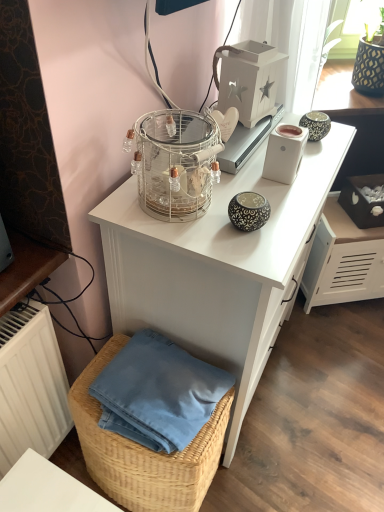
In order to face black cardboard box at right, should I rotate leftwards or rightwards?

Rotate right and turn 23.956 degrees.

The height and width of the screenshot is (512, 384). What do you see at coordinates (363, 200) in the screenshot? I see `black cardboard box at right` at bounding box center [363, 200].

Find the location of `white matte file cabinet at right`. white matte file cabinet at right is located at coordinates (343, 260).

Considering their positions, is woven straw basket at lower left located in front of or behind white matte rectangular device at upper center, the 2th appliance when ordered from top to bottom?

Visually, woven straw basket at lower left is located in front of white matte rectangular device at upper center, the 2th appliance when ordered from top to bottom.

Which of these two, woven straw basket at lower left or white matte rectangular device at upper center, arranged as the first appliance when ordered from the bottom, is wider?

woven straw basket at lower left.

In the scene shown: Is woven straw basket at lower left shorter than white matte rectangular device at upper center, the 2th appliance when ordered from top to bottom?

No.

Which point is more forward, (237, 68) or (192, 135)?

The point (192, 135) is more forward.

Are white wooden lantern at upper center, which is the 2th appliance from bottom to top, and clear glass birdcage at upper center far apart?

No.

What's the angular difference between white wooden lantern at upper center, acting as the first appliance starting from the top, and clear glass birdcage at upper center's facing directions?

11.2 degrees.

Is white wooden lantern at upper center, which is the 2th appliance from bottom to top, positioned with its back to clear glass birdcage at upper center?

No, white wooden lantern at upper center, which is the 2th appliance from bottom to top, is not facing the opposite direction of clear glass birdcage at upper center.

Is black cardboard box at right oriented away from white matte rectangular device at upper center, the 2th appliance when ordered from top to bottom?

black cardboard box at right does not have its back to white matte rectangular device at upper center, the 2th appliance when ordered from top to bottom.

Based on their positions, is black cardboard box at right located to the left or right of white matte rectangular device at upper center, the 2th appliance when ordered from top to bottom?

Clearly, black cardboard box at right is on the right of white matte rectangular device at upper center, the 2th appliance when ordered from top to bottom, in the image.

Is black cardboard box at right situated inside white matte rectangular device at upper center, the 2th appliance when ordered from top to bottom, or outside?

black cardboard box at right is located beyond the bounds of white matte rectangular device at upper center, the 2th appliance when ordered from top to bottom.

Looking at this image, is black cardboard box at right wider than white matte rectangular device at upper center, the 2th appliance when ordered from top to bottom?

Correct, the width of black cardboard box at right exceeds that of white matte rectangular device at upper center, the 2th appliance when ordered from top to bottom.

Could you tell me if black cardboard box at right is facing woven straw basket at lower left?

No, black cardboard box at right does not turn towards woven straw basket at lower left.

Considering the sizes of objects black cardboard box at right and woven straw basket at lower left in the image provided, who is shorter, black cardboard box at right or woven straw basket at lower left?

black cardboard box at right.

You are a GUI agent. You are given a task and a screenshot of the screen. Output one action in this format:
    pyautogui.click(x=<x>, y=<y>)
    Task: Click on the box that appears behind the woven straw basket at lower left
    Image resolution: width=384 pixels, height=512 pixels.
    Given the screenshot: What is the action you would take?
    pyautogui.click(x=363, y=200)

Considering the points (300, 155) and (379, 212), which point is behind, point (300, 155) or point (379, 212)?

The point (379, 212) is more distant.

Are white matte rectangular device at upper center, arranged as the first appliance when ordered from the bottom, and black cardboard box at right far apart?

No, white matte rectangular device at upper center, arranged as the first appliance when ordered from the bottom, is not far away from black cardboard box at right.

Which is more to the left, white matte rectangular device at upper center, arranged as the first appliance when ordered from the bottom, or black cardboard box at right?

white matte rectangular device at upper center, arranged as the first appliance when ordered from the bottom.

How many degrees apart are the facing directions of white matte rectangular device at upper center, the 2th appliance when ordered from top to bottom, and black cardboard box at right?

53.2 degrees.

Visually, is white matte file cabinet at right positioned to the left or to the right of clear glass birdcage at upper center?

From the image, it's evident that white matte file cabinet at right is to the right of clear glass birdcage at upper center.

At what (x,y) coordinates should I click in order to perform the action: click on file cabinet that appears below the clear glass birdcage at upper center (from the image's perspective). Please return your answer as a coordinate pair (x, y). Looking at the image, I should click on (343, 260).

From the image's perspective, is white matte file cabinet at right below clear glass birdcage at upper center?

Yes, from the image's perspective, white matte file cabinet at right is below clear glass birdcage at upper center.

Which of these two, white matte file cabinet at right or clear glass birdcage at upper center, is bigger?

white matte file cabinet at right.

Which is in front, white matte file cabinet at right or white glossy desk at upper center?

Positioned in front is white glossy desk at upper center.

Is white matte file cabinet at right placed right next to white glossy desk at upper center?

There is a gap between white matte file cabinet at right and white glossy desk at upper center.

Which of these two, white matte file cabinet at right or white glossy desk at upper center, is wider?

With larger width is white glossy desk at upper center.

The height and width of the screenshot is (512, 384). I want to click on the 1st appliance behind the woven straw basket at lower left, starting your count from the anchor, so click(284, 153).

The width and height of the screenshot is (384, 512). What are the coordinates of `bird cage on the left of white wooden lantern at upper center, acting as the first appliance starting from the top` in the screenshot? It's located at (176, 163).

From the image, which object appears to be farther from white wooden lantern at upper center, which is the 2th appliance from bottom to top, black cardboard box at right or woven straw basket at lower left?

woven straw basket at lower left.

Looking at the image, which one is located closer to woven straw basket at lower left, clear glass birdcage at upper center or white matte rectangular device at upper center, the 2th appliance when ordered from top to bottom?

clear glass birdcage at upper center is closer to woven straw basket at lower left.

Estimate the real-world distances between objects in this image. Which object is closer to clear glass birdcage at upper center, woven straw basket at lower left or white matte rectangular device at upper center, the 2th appliance when ordered from top to bottom?

The object closer to clear glass birdcage at upper center is white matte rectangular device at upper center, the 2th appliance when ordered from top to bottom.

Estimate the real-world distances between objects in this image. Which object is further from white wooden lantern at upper center, acting as the first appliance starting from the top, white matte file cabinet at right or woven straw basket at lower left?

woven straw basket at lower left lies further to white wooden lantern at upper center, acting as the first appliance starting from the top, than the other object.

From the image, which object appears to be nearer to white glossy desk at upper center, black cardboard box at right or white matte file cabinet at right?

The object closer to white glossy desk at upper center is white matte file cabinet at right.

Considering their positions, is clear glass birdcage at upper center positioned further to white wooden lantern at upper center, acting as the first appliance starting from the top, than woven straw basket at lower left?

woven straw basket at lower left is further to white wooden lantern at upper center, acting as the first appliance starting from the top.

Which object lies further to the anchor point white matte rectangular device at upper center, the 2th appliance when ordered from top to bottom, woven straw basket at lower left or white wooden lantern at upper center, which is the 2th appliance from bottom to top?

Among the two, woven straw basket at lower left is located further to white matte rectangular device at upper center, the 2th appliance when ordered from top to bottom.

Which object lies nearer to the anchor point woven straw basket at lower left, white matte file cabinet at right or white glossy desk at upper center?

white glossy desk at upper center is positioned closer to the anchor woven straw basket at lower left.

Identify the location of file cabinet between white wooden lantern at upper center, which is the 2th appliance from bottom to top, and woven straw basket at lower left from top to bottom. (343, 260).

This screenshot has width=384, height=512. Find the location of `desk between white matte rectangular device at upper center, arranged as the first appliance when ordered from the bottom, and woven straw basket at lower left, in the vertical direction`. desk between white matte rectangular device at upper center, arranged as the first appliance when ordered from the bottom, and woven straw basket at lower left, in the vertical direction is located at coordinates (219, 267).

The width and height of the screenshot is (384, 512). What are the coordinates of `bird cage between woven straw basket at lower left and black cardboard box at right from left to right` in the screenshot? It's located at (176, 163).

Locate an element on the screen. The height and width of the screenshot is (512, 384). box located between woven straw basket at lower left and white matte file cabinet at right in the left-right direction is located at coordinates (363, 200).